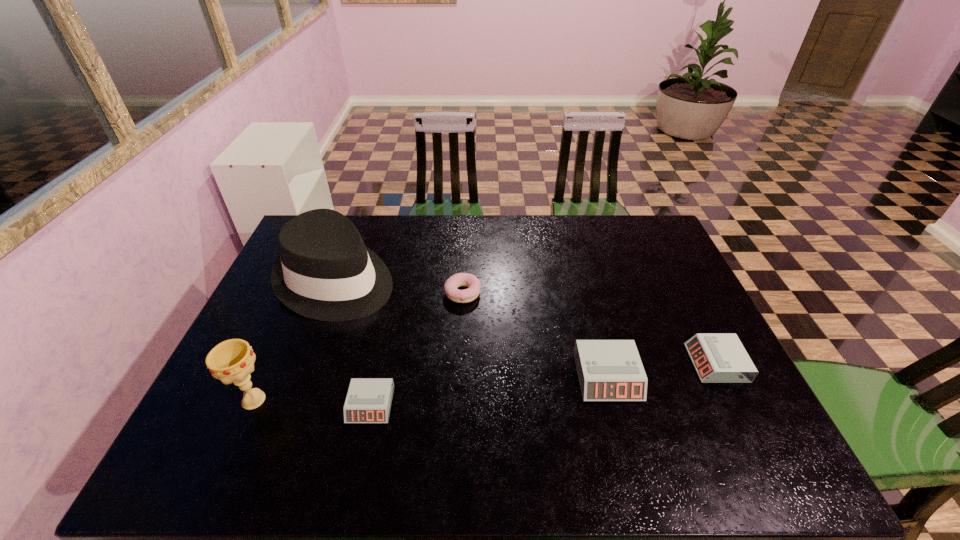
This screenshot has height=540, width=960. Find the location of `vacant area situated on the right of the fourth shortest object`. vacant area situated on the right of the fourth shortest object is located at coordinates (661, 376).

Find the location of `free space located on the back of the rightmost object`. free space located on the back of the rightmost object is located at coordinates (678, 286).

Find the location of a particular element. vacant point located on the front of the doughnut is located at coordinates (458, 410).

This screenshot has width=960, height=540. In order to click on free space located 0.060m on the right of the fedora in this screenshot , I will do `click(414, 280)`.

Identify the location of vacant space located on the right of the chalice. Image resolution: width=960 pixels, height=540 pixels. (333, 400).

In order to click on object at the far edge in this screenshot , I will do `click(325, 272)`.

This screenshot has width=960, height=540. What are the coordinates of `chalice that is at the near edge` in the screenshot? It's located at pyautogui.click(x=232, y=361).

At what (x,y) coordinates should I click in order to perform the action: click on fedora present at the left edge. Please return your answer as a coordinate pair (x, y). The height and width of the screenshot is (540, 960). Looking at the image, I should click on (325, 272).

The width and height of the screenshot is (960, 540). Find the location of `chalice that is positioned at the left edge`. chalice that is positioned at the left edge is located at coordinates (232, 361).

Where is `object present at the right edge`? This screenshot has width=960, height=540. object present at the right edge is located at coordinates (717, 357).